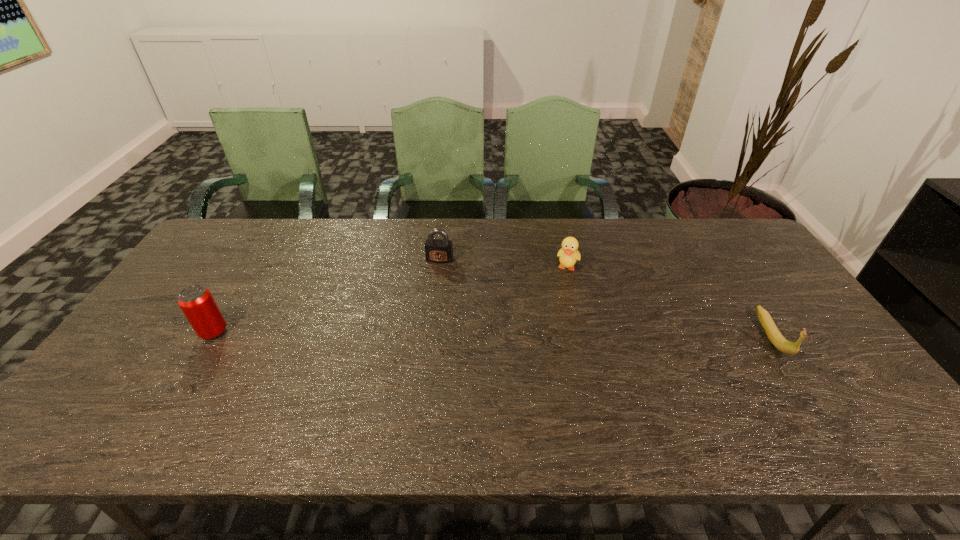
Where is `free space on the desktop that is between the can and the banana and is positioned on the front-facing side of the second object from right to left`? Image resolution: width=960 pixels, height=540 pixels. free space on the desktop that is between the can and the banana and is positioned on the front-facing side of the second object from right to left is located at coordinates [551, 334].

This screenshot has height=540, width=960. In order to click on free space on the desktop that is between the leftmost object and the rightmost object and is positioned on the front of the padlock near the keyhole in this screenshot , I will do `click(419, 333)`.